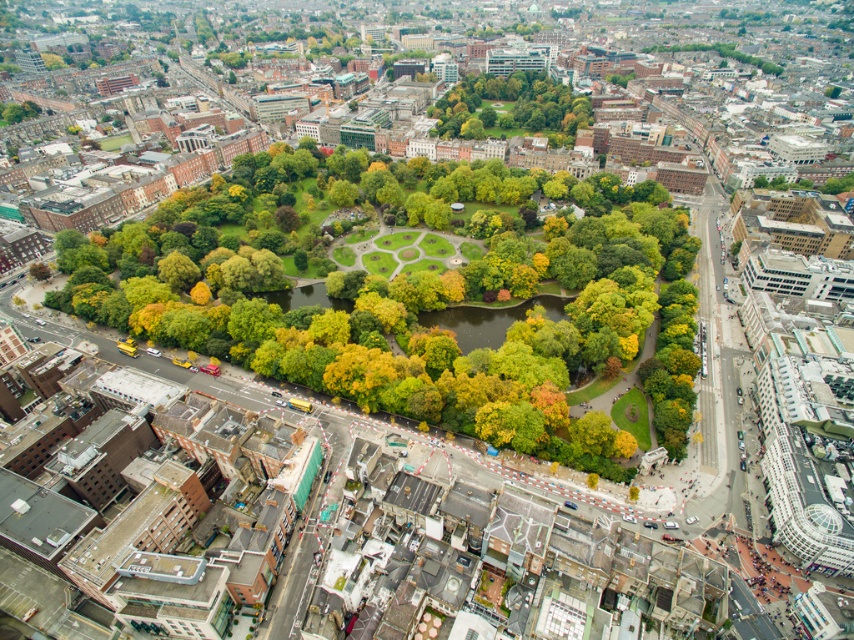
You are a drone operator trying to capture a photo of the green leafy trees at center and the green leafy tree at center from above. Based on their positions, which one would appear closer to the bottom edge of the photo?

The green leafy trees at center is located below the green leafy tree at center, so it would appear closer to the bottom edge of the photo.

You are a bird flying over the city and want to land on a tree. You see the green leafy tree at center and the green leafy tree at upper right. Which tree is positioned lower in the aerial view?

The green leafy tree at center is located below the green leafy tree at upper right, so it is positioned lower in the aerial view.